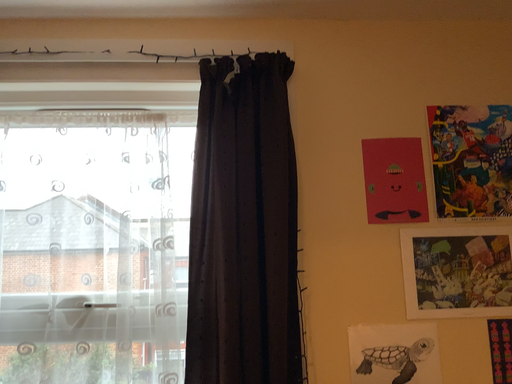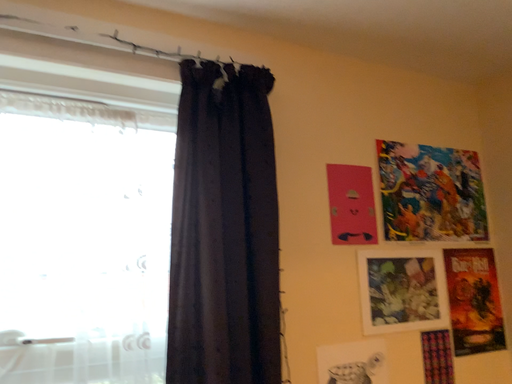
Question: How did the camera likely rotate when shooting the video?

Choices:
 (A) rotated right
 (B) rotated left

Answer: (A)